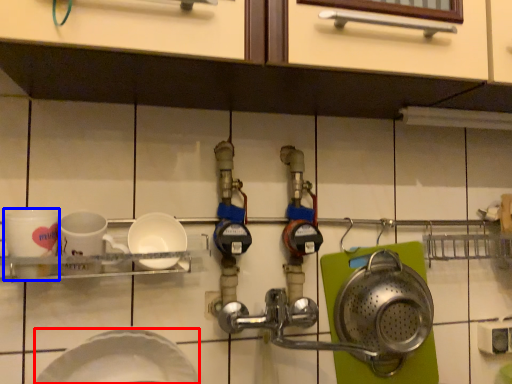
Question: Which point is closer to the camera, plate (highlighted by a red box) or coffee cup (highlighted by a blue box)?

Choices:
 (A) plate
 (B) coffee cup

Answer: (A)